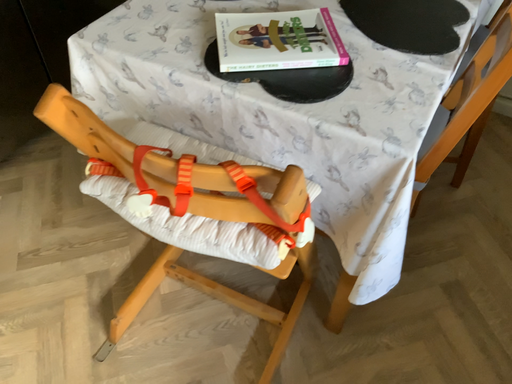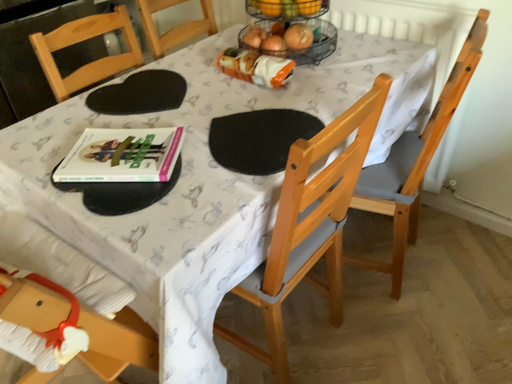
Question: How did the camera likely rotate when shooting the video?

Choices:
 (A) rotated downward
 (B) rotated upward

Answer: (B)